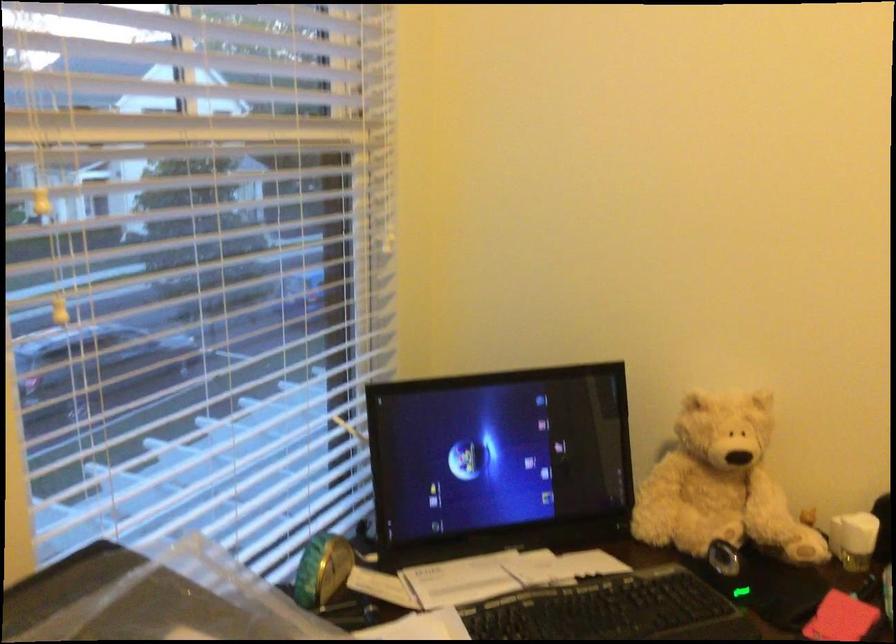
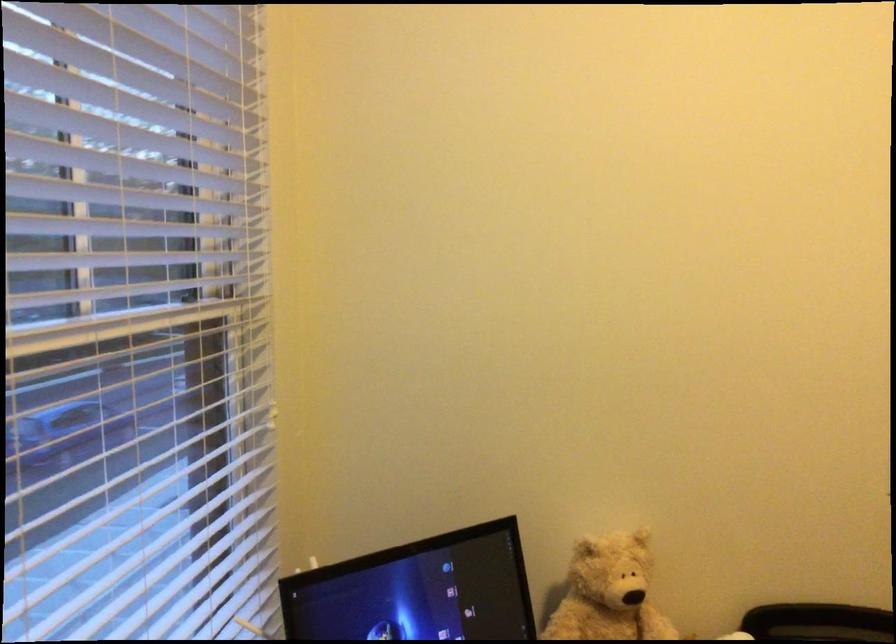
Question: How did the camera likely rotate?

Choices:
 (A) Left
 (B) Right
 (C) Up
 (D) Down

Answer: (B)